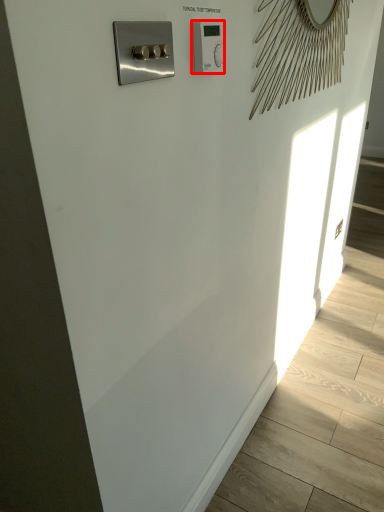
Question: From the image's perspective, where is light switch (annotated by the red box) located in relation to switch in the image?

Choices:
 (A) above
 (B) below

Answer: (A)